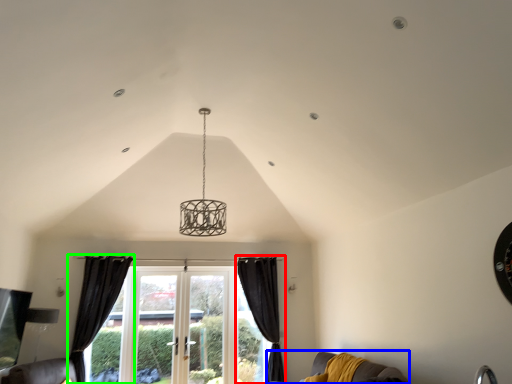
Question: Based on their relative distances, which object is nearer to curtain (highlighted by a red box)? Choose from couch (highlighted by a blue box) and curtain (highlighted by a green box).

Choices:
 (A) couch
 (B) curtain

Answer: (B)